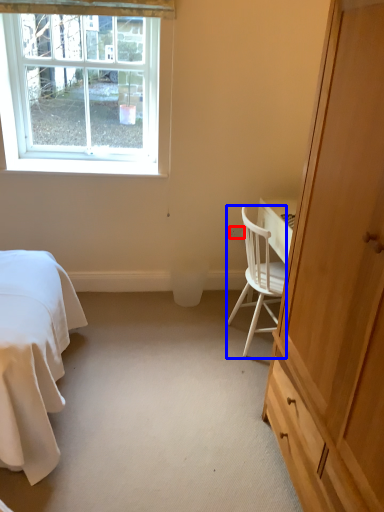
Question: Which of the following is the closest to the observer, power outlet (highlighted by a red box) or chair (highlighted by a blue box)?

Choices:
 (A) power outlet
 (B) chair

Answer: (B)